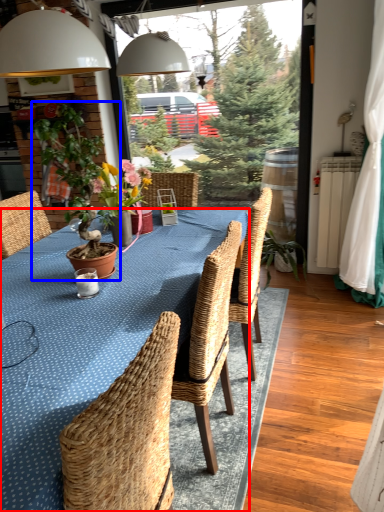
Question: Which of the following is the farthest to the observer, kitchen & dining room table (highlighted by a red box) or houseplant (highlighted by a blue box)?

Choices:
 (A) kitchen & dining room table
 (B) houseplant

Answer: (B)